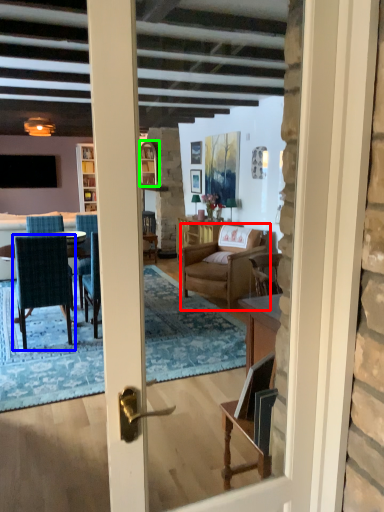
Question: Estimate the real-world distances between objects in this image. Which object is closer to chair (highlighted by a red box), chair (highlighted by a blue box) or window (highlighted by a green box)?

Choices:
 (A) chair
 (B) window

Answer: (B)